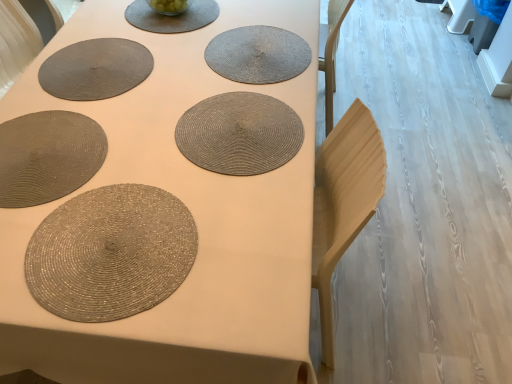
Locate an element on the screen. The height and width of the screenshot is (384, 512). unoccupied region to the right of rattan placemat at lower left, acting as the 2th paper plate starting from the back is located at coordinates (x=140, y=166).